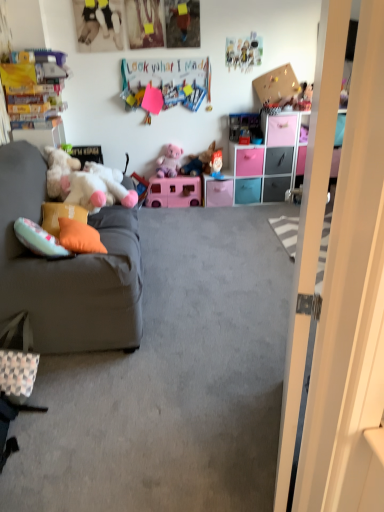
Identify the location of vacant space that is in between white glossy door at right and pink plastic drawer at center, marked as the 1th drawer in a left-to-right arrangement. (237, 301).